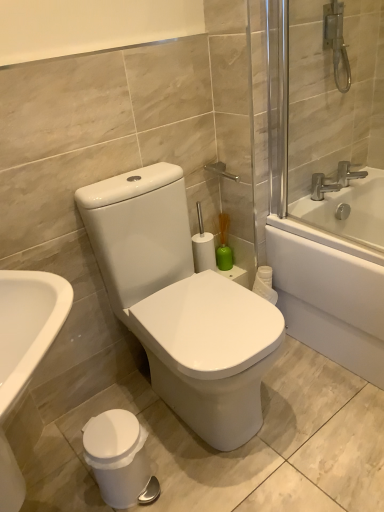
Question: Is white glossy bathtub at upper right not close to white glossy toilet at center?

Choices:
 (A) yes
 (B) no

Answer: (B)

Question: Is white glossy bathtub at upper right positioned in front of white glossy toilet at center?

Choices:
 (A) yes
 (B) no

Answer: (B)

Question: Does white glossy bathtub at upper right have a greater width compared to white glossy toilet at center?

Choices:
 (A) yes
 (B) no

Answer: (A)

Question: Can you confirm if white glossy bathtub at upper right is shorter than white glossy toilet at center?

Choices:
 (A) yes
 (B) no

Answer: (A)

Question: Is white glossy bathtub at upper right directly adjacent to white glossy toilet at center?

Choices:
 (A) no
 (B) yes

Answer: (A)

Question: Is silver metallic faucet at upper right, the first tap from the left, wider or thinner than white glossy toilet at center?

Choices:
 (A) thin
 (B) wide

Answer: (A)

Question: From the image's perspective, is silver metallic faucet at upper right, marked as the 2th tap in a right-to-left arrangement, located above or below white glossy toilet at center?

Choices:
 (A) below
 (B) above

Answer: (B)

Question: Does point (337, 189) appear closer or farther from the camera than point (205, 433)?

Choices:
 (A) farther
 (B) closer

Answer: (A)

Question: Based on their sizes in the image, would you say silver metallic faucet at upper right, the first tap from the left, is bigger or smaller than white glossy toilet at center?

Choices:
 (A) big
 (B) small

Answer: (B)

Question: Looking at the image, does silver metallic faucet at upper right, the first tap from the right, seem bigger or smaller compared to white glossy bathtub at upper right?

Choices:
 (A) small
 (B) big

Answer: (A)

Question: Is silver metallic faucet at upper right, which is the 2th tap from left to right, in front of or behind white glossy bathtub at upper right in the image?

Choices:
 (A) behind
 (B) front

Answer: (A)

Question: In terms of height, does silver metallic faucet at upper right, the first tap from the right, look taller or shorter compared to white glossy bathtub at upper right?

Choices:
 (A) short
 (B) tall

Answer: (A)

Question: Is silver metallic faucet at upper right, which is the 2th tap from left to right, situated inside white glossy bathtub at upper right or outside?

Choices:
 (A) inside
 (B) outside

Answer: (B)

Question: Looking at their shapes, would you say white glossy bathtub at upper right is wider or thinner than silver metallic faucet at upper right, the first tap from the right?

Choices:
 (A) thin
 (B) wide

Answer: (B)

Question: From the image's perspective, is white glossy bathtub at upper right located above or below silver metallic faucet at upper right, which is the 2th tap from left to right?

Choices:
 (A) below
 (B) above

Answer: (A)